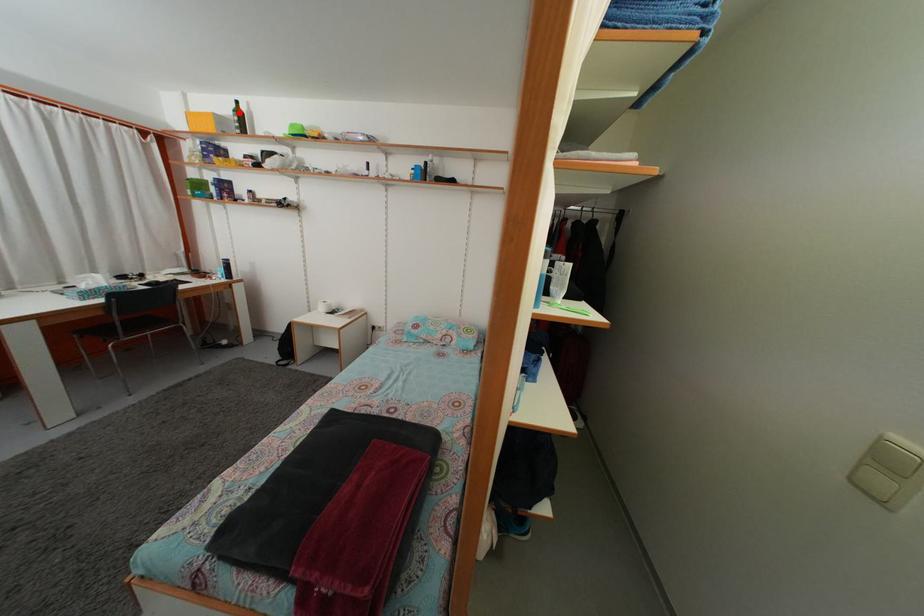
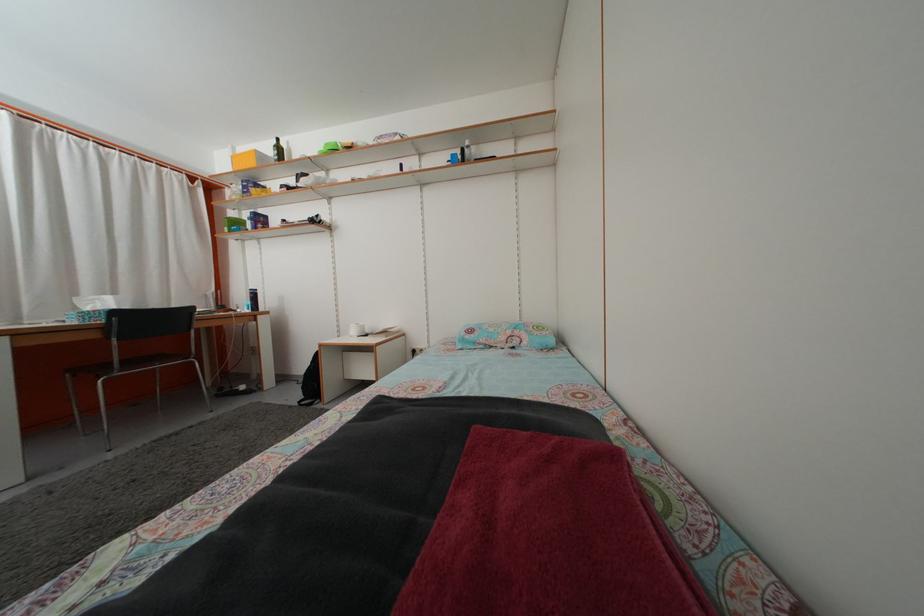
Find the pixel in the second image that matches the highlighted location in the first image.

(281, 148)